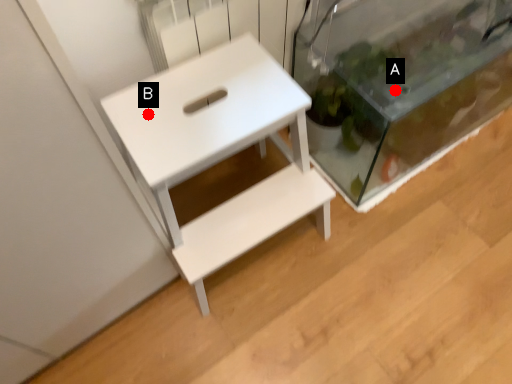
Question: Two points are circled on the image, labeled by A and B beside each circle. Which of the following is the farthest from the observer?

Choices:
 (A) A is further
 (B) B is further

Answer: (A)